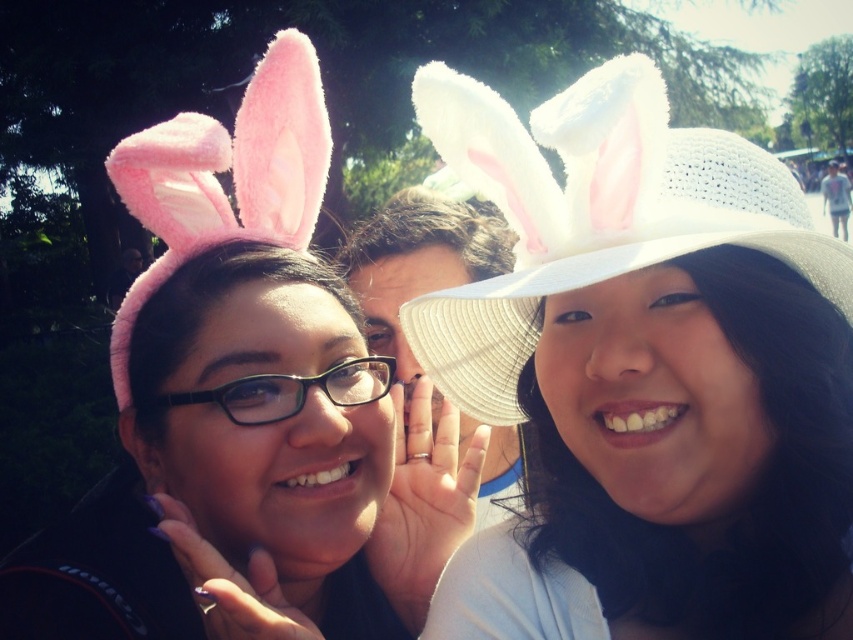
You are a photographer setting up for a group photo. You notice two hats in the scene, the white woven hat at upper right and the pink fluffy hat at left. Which hat might be more likely to block someone else in the photo due to its height?

The pink fluffy hat at left is taller than the white woven hat at upper right, so it is more likely to block someone else in the photo due to its height.

You are a photographer setting up for a group photo. You have two hats in the scene, the white woven hat at upper right and the pink fluffy hat at left. The photographer wants to ensure there is enough space between the hats for a small prop. The prop requires at least 12 inches of space. Can the prop fit between the two hats?

The white woven hat at upper right is 12.84 inches away from the pink fluffy hat at left. Since the required space is 12 inches, the prop can fit between them as the distance is sufficient.